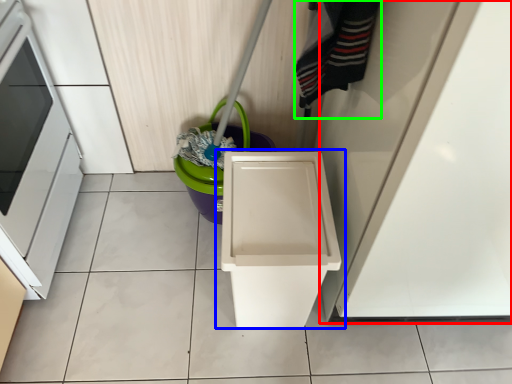
Question: Which object is the closest to the door (highlighted by a red box)? Choose among these: waste container (highlighted by a blue box) or clothing (highlighted by a green box).

Choices:
 (A) waste container
 (B) clothing

Answer: (A)